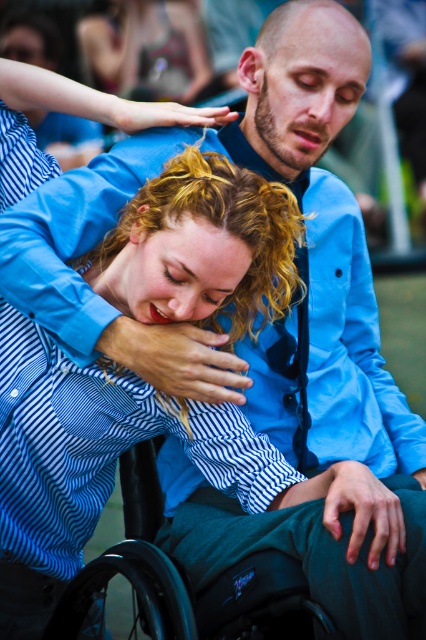
Consider the image. Does black plastic wheelchair at lower center appear on the right side of matte black hair at upper left?

Correct, you'll find black plastic wheelchair at lower center to the right of matte black hair at upper left.

This screenshot has height=640, width=426. What are the coordinates of `black plastic wheelchair at lower center` in the screenshot? It's located at (187, 580).

Is black plastic wheelchair at lower center smaller than matte blue shirt at upper left?

Incorrect, black plastic wheelchair at lower center is not smaller in size than matte blue shirt at upper left.

Between black plastic wheelchair at lower center and matte blue shirt at upper left, which one has more height?

With more height is black plastic wheelchair at lower center.

Locate an element on the screen. black plastic wheelchair at lower center is located at coordinates (187, 580).

Can you confirm if matte blue shirt at center is positioned to the left of matte blue shirt at upper left?

No, matte blue shirt at center is not to the left of matte blue shirt at upper left.

Can you confirm if matte blue shirt at center is smaller than matte blue shirt at upper left?

Incorrect, matte blue shirt at center is not smaller in size than matte blue shirt at upper left.

What do you see at coordinates (377, 358) in the screenshot? I see `matte blue shirt at center` at bounding box center [377, 358].

This screenshot has height=640, width=426. I want to click on matte blue shirt at center, so click(377, 358).